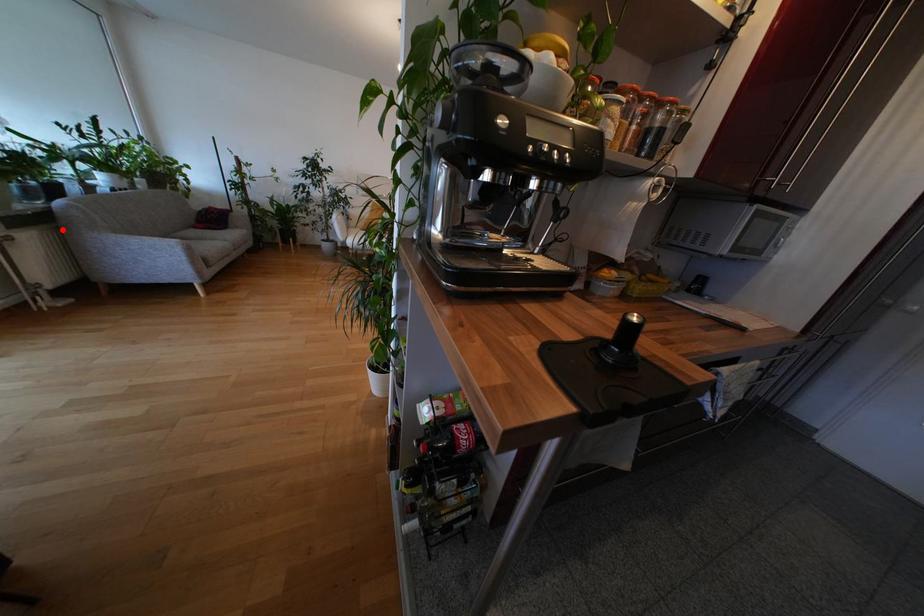
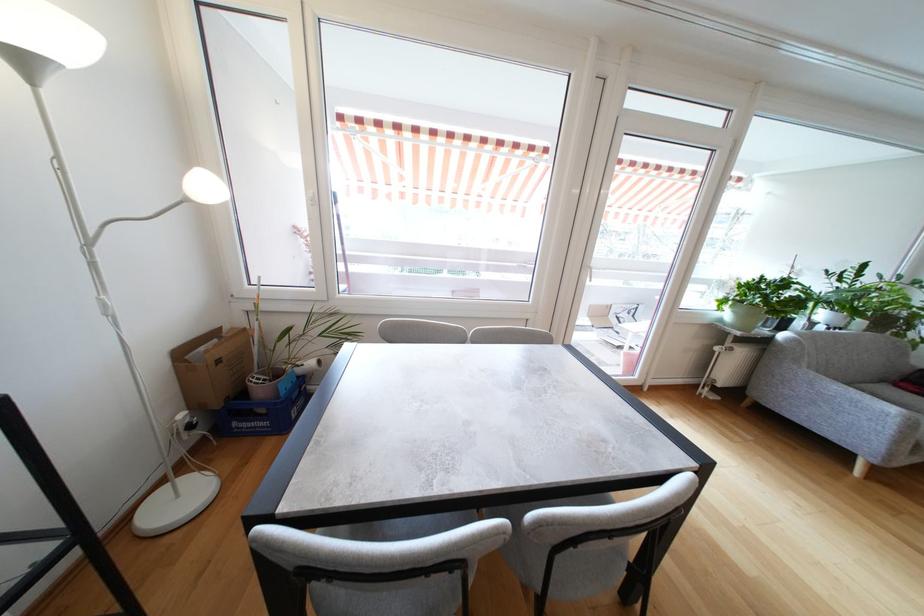
Where in the second image is the point corresponding to the highlighted location from the first image?

(768, 352)